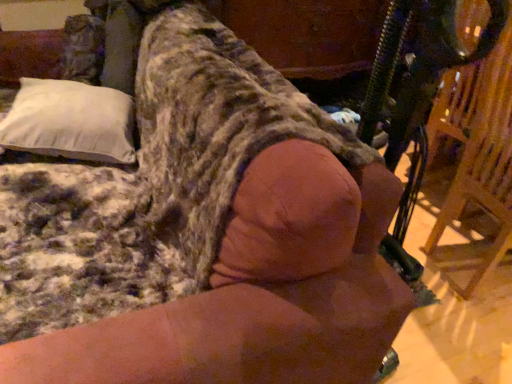
Question: Is wooden swivel chair at right inside the boundaries of white soft pillow at upper left, or outside?

Choices:
 (A) outside
 (B) inside

Answer: (A)

Question: In terms of size, does wooden swivel chair at right appear bigger or smaller than white soft pillow at upper left?

Choices:
 (A) big
 (B) small

Answer: (A)

Question: In terms of height, does wooden swivel chair at right look taller or shorter compared to white soft pillow at upper left?

Choices:
 (A) tall
 (B) short

Answer: (A)

Question: Would you say white soft pillow at upper left is to the left or to the right of wooden swivel chair at right in the picture?

Choices:
 (A) right
 (B) left

Answer: (B)

Question: In terms of width, does white soft pillow at upper left look wider or thinner when compared to wooden swivel chair at right?

Choices:
 (A) thin
 (B) wide

Answer: (A)

Question: From a real-world perspective, is white soft pillow at upper left above or below wooden swivel chair at right?

Choices:
 (A) above
 (B) below

Answer: (A)

Question: Relative to wooden swivel chair at right, is white soft pillow at upper left in front or behind?

Choices:
 (A) behind
 (B) front

Answer: (A)